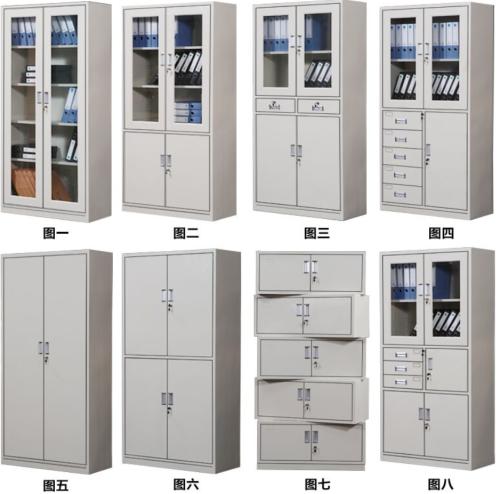
At what (x,y) coordinates should I click in order to perform the action: click on tall partial glass door cabinet to right of top left. Please return your answer as a coordinate pair (x, y). Image resolution: width=500 pixels, height=494 pixels. Looking at the image, I should click on (175, 125).